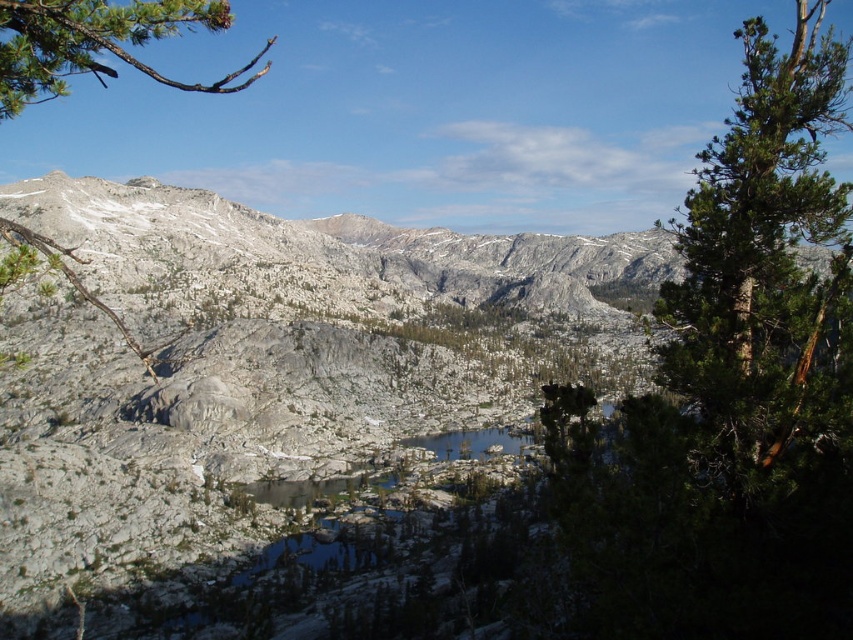
Question: Does gray rocky mountain at center appear on the right side of green needle-like branch at upper left?

Choices:
 (A) no
 (B) yes

Answer: (B)

Question: Is green textured tree at right smaller than green needle-like branch at upper left?

Choices:
 (A) no
 (B) yes

Answer: (A)

Question: Which of these objects is positioned farthest from the gray rocky mountain at center?

Choices:
 (A) green needle-like branch at upper left
 (B) green textured tree at right

Answer: (A)

Question: Among these points, which one is nearest to the camera?

Choices:
 (A) (80, 58)
 (B) (848, 54)
 (C) (480, 557)

Answer: (A)

Question: Considering the real-world distances, which object is closest to the gray rocky mountain at center?

Choices:
 (A) green needle-like branch at upper left
 (B) green textured tree at right

Answer: (B)

Question: Where is gray rocky mountain at center located in relation to green needle-like branch at upper left in the image?

Choices:
 (A) right
 (B) left

Answer: (A)